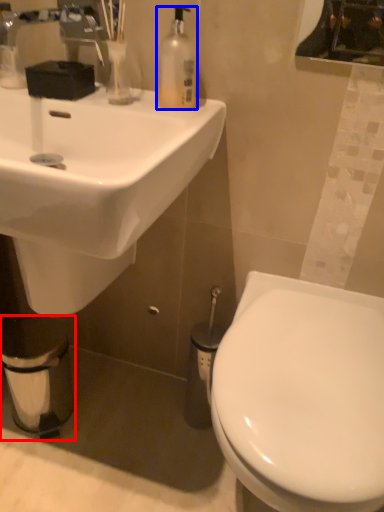
Question: Which object appears closest to the camera in this image, toilet paper (highlighted by a red box) or bottle (highlighted by a blue box)?

Choices:
 (A) toilet paper
 (B) bottle

Answer: (B)